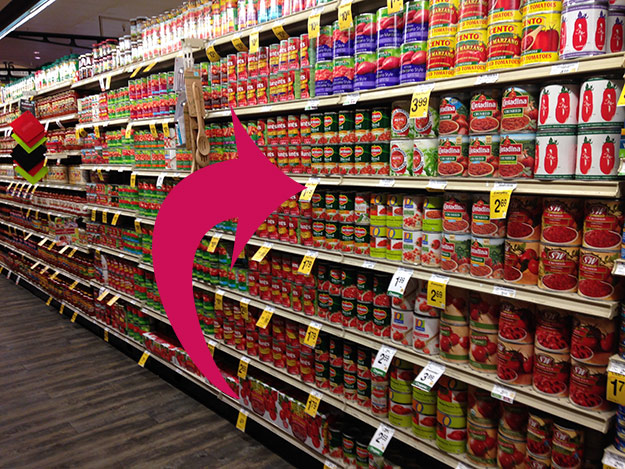
This screenshot has height=469, width=625. Identify the location of wooden spoon hanging on rack in from of shelf, just behind large red arrow. (198, 104), (201, 144).